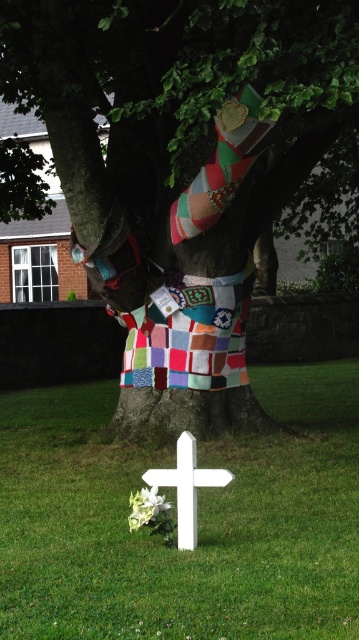
Question: Which point is closer to the camera taking this photo?

Choices:
 (A) (124, 365)
 (B) (278, 576)

Answer: (B)

Question: Which point is closer to the camera?

Choices:
 (A) patchwork quilted tree trunk at center
 (B) white matte cross at lower center
 (C) patchwork quilt at upper center
 (D) green grass at lower center

Answer: (D)

Question: Does patchwork quilt at upper center have a greater width compared to white matte cross at lower center?

Choices:
 (A) no
 (B) yes

Answer: (B)

Question: Does patchwork quilted tree trunk at center lie behind patchwork quilt at upper center?

Choices:
 (A) yes
 (B) no

Answer: (B)

Question: Which object appears closest to the camera in this image?

Choices:
 (A) white matte cross at lower center
 (B) patchwork quilted tree trunk at center
 (C) green grass at lower center

Answer: (C)

Question: Does green grass at lower center have a lesser width compared to patchwork quilt at upper center?

Choices:
 (A) yes
 (B) no

Answer: (B)